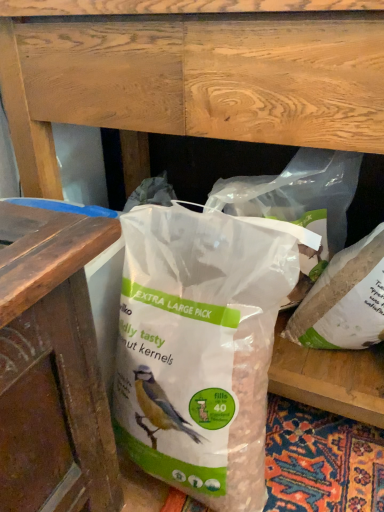
Describe the element at coordinates (299, 203) in the screenshot. I see `translucent plastic bag at center, the 2th plastic bag positioned from the right` at that location.

You are a GUI agent. You are given a task and a screenshot of the screen. Output one action in this format:
    pyautogui.click(x=<x>, y=<y>)
    Task: Click on the translucent plastic bag at center, marked as the second plastic bag in a left-to-right arrangement
    
    Given the screenshot: What is the action you would take?
    pyautogui.click(x=299, y=203)

Does white matte plastic bag at center, arranged as the 1th plastic bag when viewed from the right, turn towards translucent plastic bag at center, the first plastic bag positioned from the left?

No, white matte plastic bag at center, arranged as the 1th plastic bag when viewed from the right, is not aimed at translucent plastic bag at center, the first plastic bag positioned from the left.

Considering the sizes of white matte plastic bag at center, the third plastic bag in the left-to-right sequence, and translucent plastic bag at center, placed as the 3th plastic bag when sorted from right to left, in the image, is white matte plastic bag at center, the third plastic bag in the left-to-right sequence, taller or shorter than translucent plastic bag at center, placed as the 3th plastic bag when sorted from right to left,?

Considering their sizes, white matte plastic bag at center, the third plastic bag in the left-to-right sequence, has less height than translucent plastic bag at center, placed as the 3th plastic bag when sorted from right to left.

In terms of width, does white matte plastic bag at center, the third plastic bag in the left-to-right sequence, look wider or thinner when compared to translucent plastic bag at center, the first plastic bag positioned from the left?

white matte plastic bag at center, the third plastic bag in the left-to-right sequence, is thinner than translucent plastic bag at center, the first plastic bag positioned from the left.

Is white matte plastic bag at center, the third plastic bag in the left-to-right sequence, a part of translucent plastic bag at center, marked as the second plastic bag in a left-to-right arrangement?

Yes, white matte plastic bag at center, the third plastic bag in the left-to-right sequence, can be found within translucent plastic bag at center, marked as the second plastic bag in a left-to-right arrangement.

Is translucent plastic bag at center, the 2th plastic bag positioned from the right, wider than white matte plastic bag at center, arranged as the 1th plastic bag when viewed from the right?

Correct, the width of translucent plastic bag at center, the 2th plastic bag positioned from the right, exceeds that of white matte plastic bag at center, arranged as the 1th plastic bag when viewed from the right.

From the picture: Could you tell me if translucent plastic bag at center, the 2th plastic bag positioned from the right, is turned towards white matte plastic bag at center, arranged as the 1th plastic bag when viewed from the right?

No, translucent plastic bag at center, the 2th plastic bag positioned from the right, does not turn towards white matte plastic bag at center, arranged as the 1th plastic bag when viewed from the right.

This screenshot has height=512, width=384. Identify the location of plastic bag above the white matte plastic bag at center, arranged as the 1th plastic bag when viewed from the right (from the image's perspective). (299, 203).

Does white matte plastic bag at center, the third plastic bag in the left-to-right sequence, have a larger size compared to translucent plastic bag at center, the 2th plastic bag positioned from the right?

No.

The width and height of the screenshot is (384, 512). What are the coordinates of `plastic bag above the white matte plastic bag at center, the third plastic bag in the left-to-right sequence (from the image's perspective)` in the screenshot? It's located at (299, 203).

Does white matte plastic bag at center, the third plastic bag in the left-to-right sequence, lie behind translucent plastic bag at center, marked as the second plastic bag in a left-to-right arrangement?

Yes.

From a real-world perspective, is translucent plastic bag at center, placed as the 3th plastic bag when sorted from right to left, physically below white matte plastic bag at center, arranged as the 1th plastic bag when viewed from the right?

Correct, in the physical world, translucent plastic bag at center, placed as the 3th plastic bag when sorted from right to left, is lower than white matte plastic bag at center, arranged as the 1th plastic bag when viewed from the right.

Considering the sizes of objects translucent plastic bag at center, the first plastic bag positioned from the left, and white matte plastic bag at center, arranged as the 1th plastic bag when viewed from the right, in the image provided, who is bigger, translucent plastic bag at center, the first plastic bag positioned from the left, or white matte plastic bag at center, arranged as the 1th plastic bag when viewed from the right,?

translucent plastic bag at center, the first plastic bag positioned from the left.

Is translucent plastic bag at center, the first plastic bag positioned from the left, spatially inside white matte plastic bag at center, the third plastic bag in the left-to-right sequence, or outside of it?

The correct answer is: outside.

Could you tell me if translucent plastic bag at center, the first plastic bag positioned from the left, is facing white matte plastic bag at center, the third plastic bag in the left-to-right sequence?

No, translucent plastic bag at center, the first plastic bag positioned from the left, is not turned towards white matte plastic bag at center, the third plastic bag in the left-to-right sequence.

Looking at the image, does translucent plastic bag at center, the 2th plastic bag positioned from the right, seem bigger or smaller compared to translucent plastic bag at center, the first plastic bag positioned from the left?

In the image, translucent plastic bag at center, the 2th plastic bag positioned from the right, appears to be smaller than translucent plastic bag at center, the first plastic bag positioned from the left.

Can you tell me how much translucent plastic bag at center, marked as the second plastic bag in a left-to-right arrangement, and translucent plastic bag at center, the first plastic bag positioned from the left, differ in facing direction?

There is a 0.149-degree angle between the facing directions of translucent plastic bag at center, marked as the second plastic bag in a left-to-right arrangement, and translucent plastic bag at center, the first plastic bag positioned from the left.

Is translucent plastic bag at center, marked as the second plastic bag in a left-to-right arrangement, in contact with translucent plastic bag at center, placed as the 3th plastic bag when sorted from right to left?

translucent plastic bag at center, marked as the second plastic bag in a left-to-right arrangement, is not next to translucent plastic bag at center, placed as the 3th plastic bag when sorted from right to left, and they're not touching.

Can we say translucent plastic bag at center, the 2th plastic bag positioned from the right, lies outside translucent plastic bag at center, placed as the 3th plastic bag when sorted from right to left?

Yes, translucent plastic bag at center, the 2th plastic bag positioned from the right, is located beyond the bounds of translucent plastic bag at center, placed as the 3th plastic bag when sorted from right to left.

Which of these two, translucent plastic bag at center, placed as the 3th plastic bag when sorted from right to left, or translucent plastic bag at center, the 2th plastic bag positioned from the right, is thinner?

With smaller width is translucent plastic bag at center, the 2th plastic bag positioned from the right.

Considering the relative positions of translucent plastic bag at center, the first plastic bag positioned from the left, and translucent plastic bag at center, the 2th plastic bag positioned from the right, in the image provided, is translucent plastic bag at center, the first plastic bag positioned from the left, to the right of translucent plastic bag at center, the 2th plastic bag positioned from the right, from the viewer's perspective?

In fact, translucent plastic bag at center, the first plastic bag positioned from the left, is to the left of translucent plastic bag at center, the 2th plastic bag positioned from the right.

Can you confirm if translucent plastic bag at center, the first plastic bag positioned from the left, is bigger than translucent plastic bag at center, marked as the second plastic bag in a left-to-right arrangement?

Indeed, translucent plastic bag at center, the first plastic bag positioned from the left, has a larger size compared to translucent plastic bag at center, marked as the second plastic bag in a left-to-right arrangement.

Is translucent plastic bag at center, the 2th plastic bag positioned from the right, completely or partially inside translucent plastic bag at center, the first plastic bag positioned from the left?

No, translucent plastic bag at center, the 2th plastic bag positioned from the right, is not a part of translucent plastic bag at center, the first plastic bag positioned from the left.

Starting from the white matte plastic bag at center, the third plastic bag in the left-to-right sequence, which plastic bag is the 2nd one to the left? Please provide its 2D coordinates.

[(199, 349)]

The height and width of the screenshot is (512, 384). What are the coordinates of `plastic bag lying behind the translucent plastic bag at center, the 2th plastic bag positioned from the right` in the screenshot? It's located at click(x=345, y=300).

Considering their positions, is white matte plastic bag at center, the third plastic bag in the left-to-right sequence, positioned closer to translucent plastic bag at center, placed as the 3th plastic bag when sorted from right to left, than translucent plastic bag at center, marked as the second plastic bag in a left-to-right arrangement?

The object closer to translucent plastic bag at center, placed as the 3th plastic bag when sorted from right to left, is translucent plastic bag at center, marked as the second plastic bag in a left-to-right arrangement.

Based on their spatial positions, is translucent plastic bag at center, the 2th plastic bag positioned from the right, or white matte plastic bag at center, arranged as the 1th plastic bag when viewed from the right, closer to translucent plastic bag at center, placed as the 3th plastic bag when sorted from right to left?

The object closer to translucent plastic bag at center, placed as the 3th plastic bag when sorted from right to left, is translucent plastic bag at center, the 2th plastic bag positioned from the right.

When comparing their distances from translucent plastic bag at center, the 2th plastic bag positioned from the right, does translucent plastic bag at center, the first plastic bag positioned from the left, or white matte plastic bag at center, arranged as the 1th plastic bag when viewed from the right, seem closer?

The object closer to translucent plastic bag at center, the 2th plastic bag positioned from the right, is white matte plastic bag at center, arranged as the 1th plastic bag when viewed from the right.

When comparing their distances from white matte plastic bag at center, arranged as the 1th plastic bag when viewed from the right, does translucent plastic bag at center, marked as the second plastic bag in a left-to-right arrangement, or translucent plastic bag at center, the first plastic bag positioned from the left, seem closer?

The object closer to white matte plastic bag at center, arranged as the 1th plastic bag when viewed from the right, is translucent plastic bag at center, marked as the second plastic bag in a left-to-right arrangement.

From the image, which object appears to be nearer to white matte plastic bag at center, the third plastic bag in the left-to-right sequence, translucent plastic bag at center, placed as the 3th plastic bag when sorted from right to left, or translucent plastic bag at center, the 2th plastic bag positioned from the right?

Based on the image, translucent plastic bag at center, the 2th plastic bag positioned from the right, appears to be nearer to white matte plastic bag at center, the third plastic bag in the left-to-right sequence.

When comparing their distances from translucent plastic bag at center, the 2th plastic bag positioned from the right, does white matte plastic bag at center, the third plastic bag in the left-to-right sequence, or translucent plastic bag at center, placed as the 3th plastic bag when sorted from right to left, seem closer?

Among the two, white matte plastic bag at center, the third plastic bag in the left-to-right sequence, is located nearer to translucent plastic bag at center, the 2th plastic bag positioned from the right.

Where is `plastic bag between translucent plastic bag at center, the first plastic bag positioned from the left, and white matte plastic bag at center, arranged as the 1th plastic bag when viewed from the right`? The width and height of the screenshot is (384, 512). plastic bag between translucent plastic bag at center, the first plastic bag positioned from the left, and white matte plastic bag at center, arranged as the 1th plastic bag when viewed from the right is located at coordinates (299, 203).